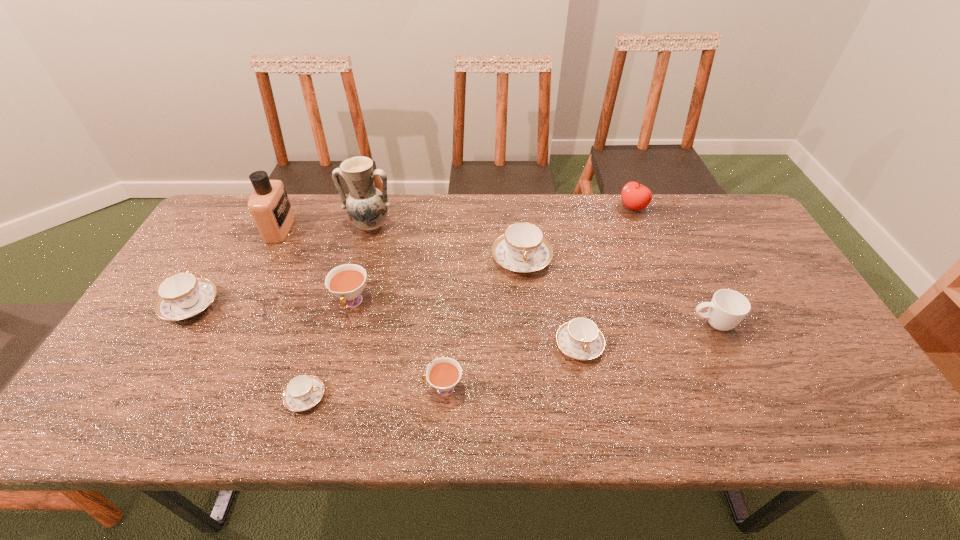
The height and width of the screenshot is (540, 960). I want to click on vacant position at the right edge of the desktop, so click(773, 355).

Where is `free space at the far left corner of the desktop`? free space at the far left corner of the desktop is located at coordinates (228, 220).

The width and height of the screenshot is (960, 540). I want to click on free space at the near left corner, so point(79,418).

Identify the location of free space at the far right corner of the desktop. This screenshot has height=540, width=960. (708, 211).

You are a GUI agent. You are given a task and a screenshot of the screen. Output one action in this format:
    pyautogui.click(x=<x>, y=<y>)
    Task: Click on the blank area at the near right corner
    
    Given the screenshot: What is the action you would take?
    pyautogui.click(x=868, y=421)

You are a GUI agent. You are given a task and a screenshot of the screen. Output one action in this format:
    pyautogui.click(x=<x>, y=<y>)
    Task: Click on the free area in between the ninth shortest object and the third biggest blue teacup
    
    Given the screenshot: What is the action you would take?
    pyautogui.click(x=429, y=287)

This screenshot has width=960, height=540. Identify the location of free spot between the biggest blue teacup and the bigger white teacup. (437, 281).

Where is `empty space that is in between the pottery and the smallest blue teacup`? Image resolution: width=960 pixels, height=540 pixels. empty space that is in between the pottery and the smallest blue teacup is located at coordinates (338, 311).

This screenshot has height=540, width=960. What are the coordinates of `unoccupied position between the pottery and the farther white teacup` in the screenshot? It's located at pos(361,264).

Find the location of a particular element. Image resolution: width=960 pixels, height=540 pixels. blank region between the apple and the shortest object is located at coordinates (469, 302).